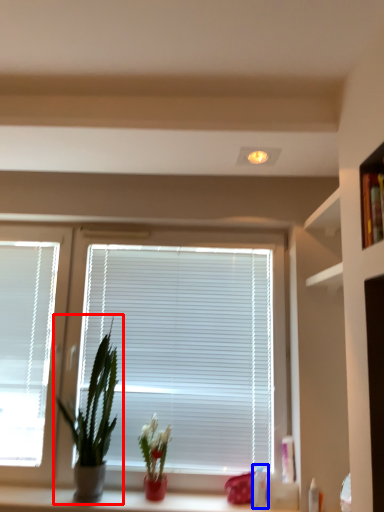
Question: Which of the following is the farthest to the observer, houseplant (highlighted by a red box) or toiletry (highlighted by a blue box)?

Choices:
 (A) houseplant
 (B) toiletry

Answer: (B)